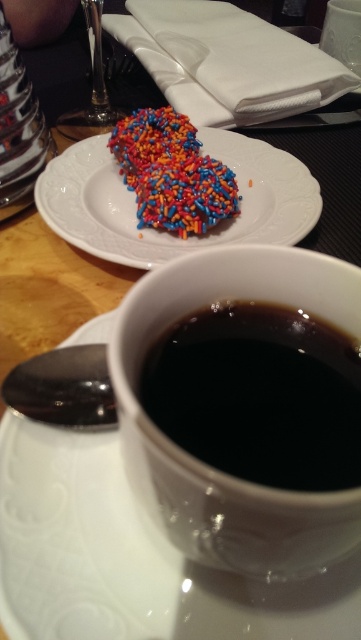
Between candy-coated donut at upper left and candy-coated donut at center, which one appears on the right side from the viewer's perspective?

candy-coated donut at upper left

Who is higher up, candy-coated donut at upper left or candy-coated donut at center?

Positioned higher is candy-coated donut at center.

Where is `candy-coated donut at upper left`? candy-coated donut at upper left is located at coordinates (171, 173).

Is white ceramic saucer at upper center taller than candy-coated donut at center?

Yes.

The height and width of the screenshot is (640, 361). What do you see at coordinates (128, 557) in the screenshot?
I see `white ceramic saucer at upper center` at bounding box center [128, 557].

Who is more forward, (x=54, y=586) or (x=132, y=122)?

Point (x=54, y=586)

The image size is (361, 640). I want to click on white ceramic saucer at upper center, so click(128, 557).

Is white ceramic saucer at upper center above candy-coated donut at upper left?

Actually, white ceramic saucer at upper center is below candy-coated donut at upper left.

Who is more forward, (x=55, y=612) or (x=154, y=173)?

Point (x=55, y=612)

You are a GUI agent. You are given a task and a screenshot of the screen. Output one action in this format:
    pyautogui.click(x=<x>, y=<y>)
    Task: Click on the white ceramic saucer at upper center
    
    Given the screenshot: What is the action you would take?
    pyautogui.click(x=128, y=557)